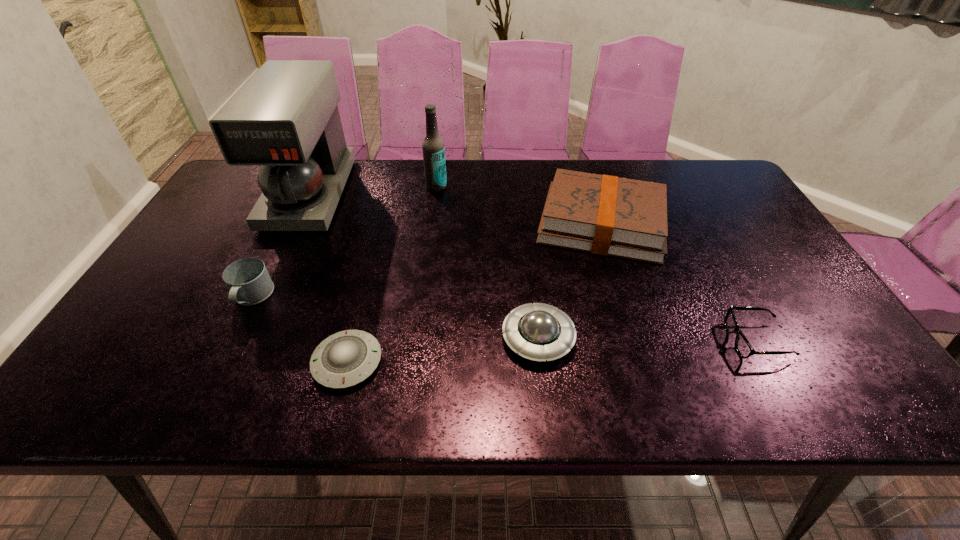
In order to click on vacant area located on the label of the second tallest object in this screenshot , I will do `click(428, 256)`.

I want to click on vacant region located 0.340m on the front of the fifth shortest object, so point(649,378).

The image size is (960, 540). I want to click on vacant area situated 0.050m on the side of the mug with the handle, so click(234, 334).

You are a GUI agent. You are given a task and a screenshot of the screen. Output one action in this format:
    pyautogui.click(x=<x>, y=<y>)
    Task: Click on the vacant area situated on the back of the right saucer
    Image resolution: width=960 pixels, height=540 pixels.
    Given the screenshot: What is the action you would take?
    pos(532,286)

Find the location of a particular element. This screenshot has height=540, width=960. vacant space situated 0.200m on the front-facing side of the sunglasses is located at coordinates (639, 341).

Image resolution: width=960 pixels, height=540 pixels. Find the location of `blank space located on the front-facing side of the sunglasses`. blank space located on the front-facing side of the sunglasses is located at coordinates (675, 341).

Where is `vacant space located 0.080m on the front-facing side of the sunglasses`? vacant space located 0.080m on the front-facing side of the sunglasses is located at coordinates (693, 341).

The height and width of the screenshot is (540, 960). In order to click on vacant space located on the left of the third object from left to right in this screenshot , I will do `click(228, 362)`.

This screenshot has width=960, height=540. I want to click on coffee maker located at the far edge, so click(x=285, y=119).

At what (x,y) coordinates should I click in order to perform the action: click on beer bottle positioned at the far edge. Please return your answer as a coordinate pair (x, y). This screenshot has width=960, height=540. Looking at the image, I should click on (433, 148).